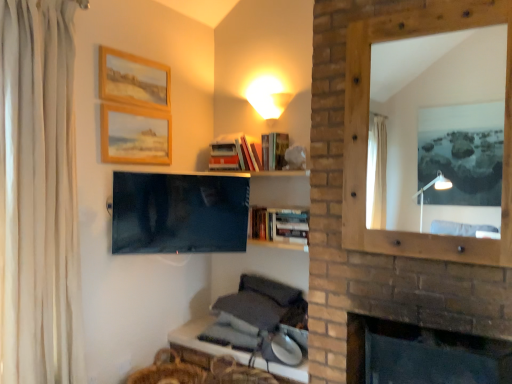
Question: Is wooden table at lower center not within dark brick fireplace at lower right?

Choices:
 (A) no
 (B) yes

Answer: (B)

Question: Is wooden table at lower center beside dark brick fireplace at lower right?

Choices:
 (A) yes
 (B) no

Answer: (B)

Question: Is the depth of wooden table at lower center greater than that of dark brick fireplace at lower right?

Choices:
 (A) yes
 (B) no

Answer: (A)

Question: Does wooden table at lower center have a larger size compared to dark brick fireplace at lower right?

Choices:
 (A) no
 (B) yes

Answer: (A)

Question: Is wooden table at lower center wider than dark brick fireplace at lower right?

Choices:
 (A) no
 (B) yes

Answer: (A)

Question: Is point (39, 170) closer or farther from the camera than point (187, 185)?

Choices:
 (A) closer
 (B) farther

Answer: (A)

Question: Is white fabric curtain at left inside or outside of matte black tv at center?

Choices:
 (A) outside
 (B) inside

Answer: (A)

Question: In terms of size, does white fabric curtain at left appear bigger or smaller than matte black tv at center?

Choices:
 (A) small
 (B) big

Answer: (B)

Question: In the image, is white fabric curtain at left positioned in front of or behind matte black tv at center?

Choices:
 (A) behind
 (B) front

Answer: (B)

Question: Is dark brick fireplace at lower right in front of or behind hardcover book at upper center, the second book viewed from the top, in the image?

Choices:
 (A) front
 (B) behind

Answer: (A)

Question: Considering the positions of dark brick fireplace at lower right and hardcover book at upper center, the second book viewed from the top, in the image, is dark brick fireplace at lower right bigger or smaller than hardcover book at upper center, the second book viewed from the top,?

Choices:
 (A) small
 (B) big

Answer: (B)

Question: In terms of width, does dark brick fireplace at lower right look wider or thinner when compared to hardcover book at upper center, the second book viewed from the top?

Choices:
 (A) thin
 (B) wide

Answer: (B)

Question: Is point (417, 349) closer or farther from the camera than point (264, 165)?

Choices:
 (A) closer
 (B) farther

Answer: (A)

Question: Relative to hardcover books at upper center, which is the 4th book from bottom to top, is white fabric curtain at left in front or behind?

Choices:
 (A) behind
 (B) front

Answer: (B)

Question: Which is correct: white fabric curtain at left is inside hardcover books at upper center, positioned as the first book in top-to-bottom order, or outside of it?

Choices:
 (A) outside
 (B) inside

Answer: (A)